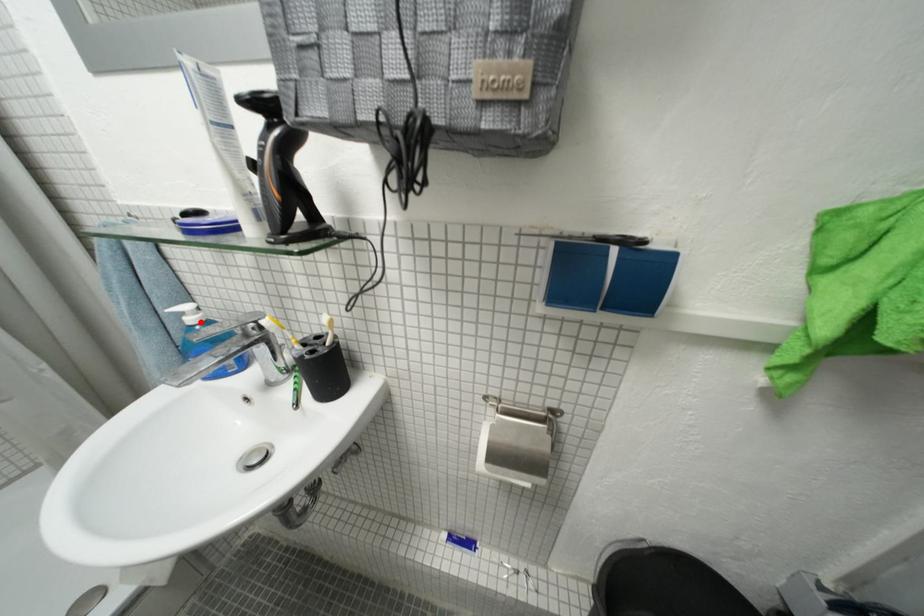
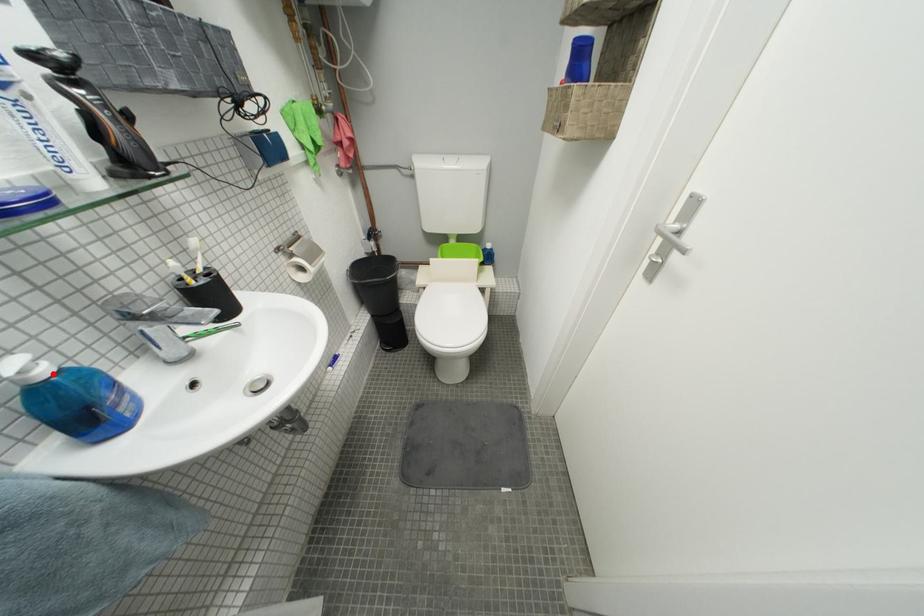
I am providing you with two images of the same scene from different viewpoints. A red point is marked on the first image and another point is marked on the second image. Is the marked point in image1 the same physical position as the marked point in image2?

Yes